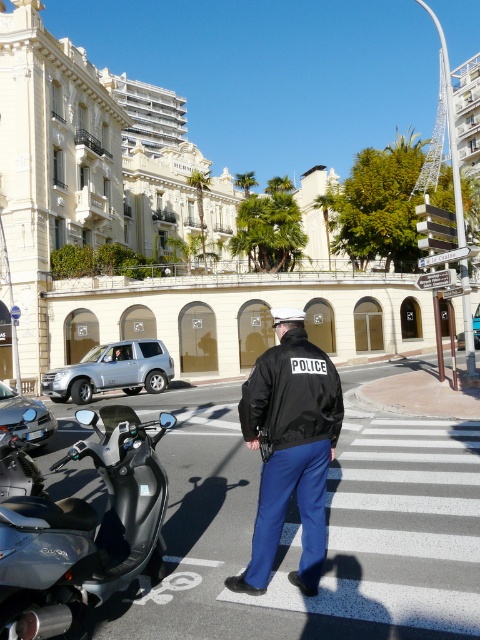
Question: Which point appears farthest from the camera in this image?

Choices:
 (A) (232, 580)
 (B) (54, 500)

Answer: (B)

Question: Is black matte scooter at lower left closer to camera compared to black leather jacket at center?

Choices:
 (A) yes
 (B) no

Answer: (A)

Question: Does black matte scooter at lower left have a lesser width compared to black leather jacket at center?

Choices:
 (A) yes
 (B) no

Answer: (B)

Question: Can you confirm if black matte scooter at lower left is positioned to the right of black leather jacket at center?

Choices:
 (A) yes
 (B) no

Answer: (B)